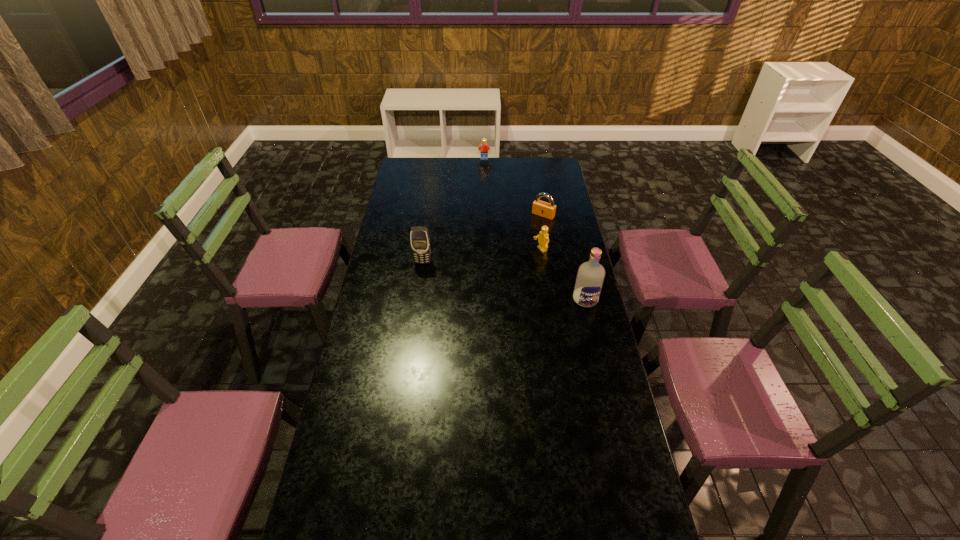
This screenshot has width=960, height=540. Identify the location of free spot that satisfies the following two spatial constraints: 1. on the front side of the farthest object; 2. on the left side of the padlock. (485, 215).